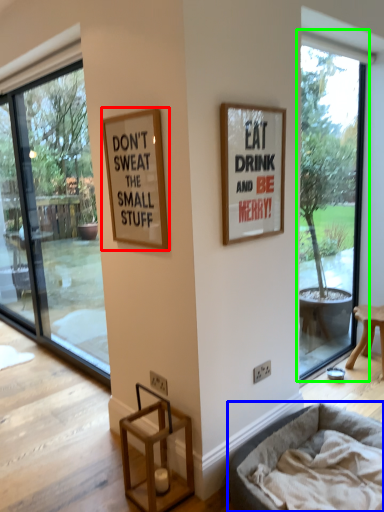
Question: Estimate the real-world distances between objects in this image. Which object is closer to picture frame (highlighted by a red box), dog bed (highlighted by a blue box) or window (highlighted by a green box)?

Choices:
 (A) dog bed
 (B) window

Answer: (A)